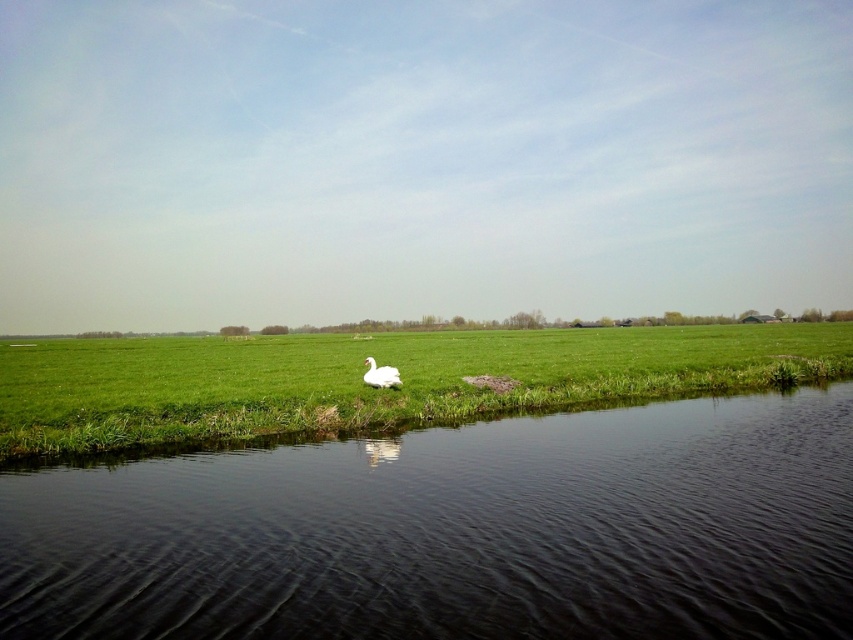
Is green grassy at center to the right of white glossy swan at center from the viewer's perspective?

In fact, green grassy at center is to the left of white glossy swan at center.

In the scene shown: Between green grassy at center and white glossy swan at center, which one has less height?

With less height is white glossy swan at center.

Between point (311, 372) and point (364, 384), which one is positioned in front?

Point (364, 384)

The width and height of the screenshot is (853, 640). I want to click on green grassy at center, so click(369, 387).

Which of these two, black water at lower center or white glossy swan at center, stands shorter?

Standing shorter between the two is black water at lower center.

Between point (679, 516) and point (378, 369), which one is positioned behind?

Point (378, 369)

The width and height of the screenshot is (853, 640). I want to click on black water at lower center, so click(456, 532).

What are the coordinates of `black water at lower center` in the screenshot? It's located at (456, 532).

Can you confirm if black water at lower center is bigger than green grassy at center?

Incorrect, black water at lower center is not larger than green grassy at center.

Between point (357, 545) and point (51, 436), which one is positioned behind?

The point (51, 436) is behind.

Find the location of `black water at lower center`. black water at lower center is located at coordinates (456, 532).